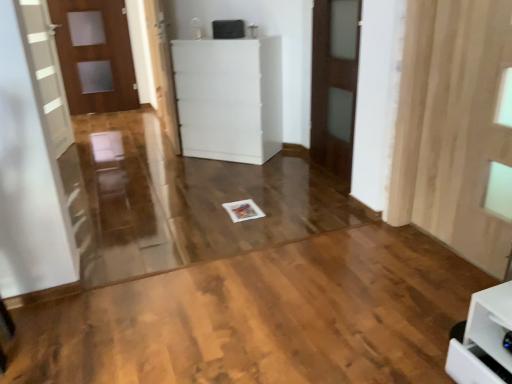
The width and height of the screenshot is (512, 384). What are the coordinates of `vacant space in front of white plastic cabinet at center` in the screenshot? It's located at (222, 175).